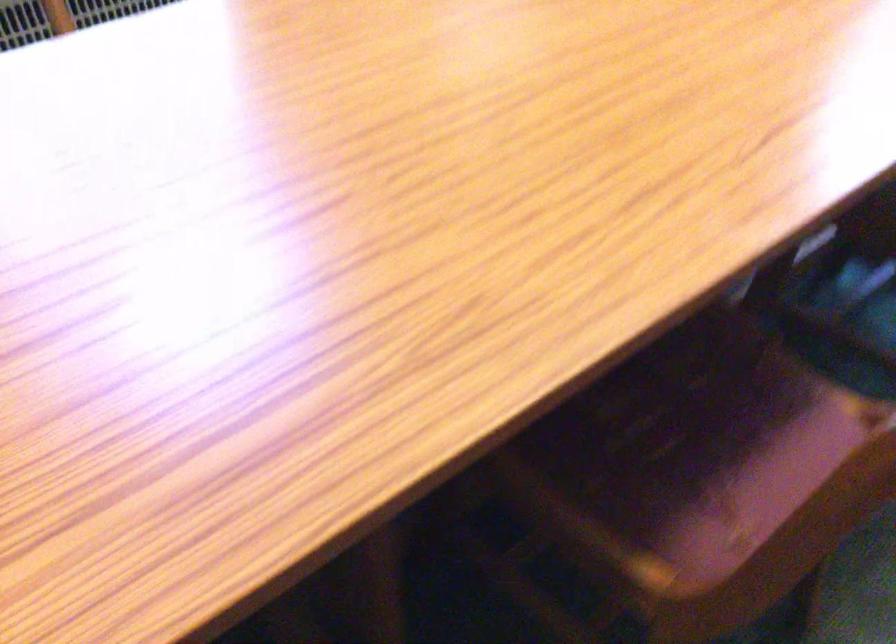
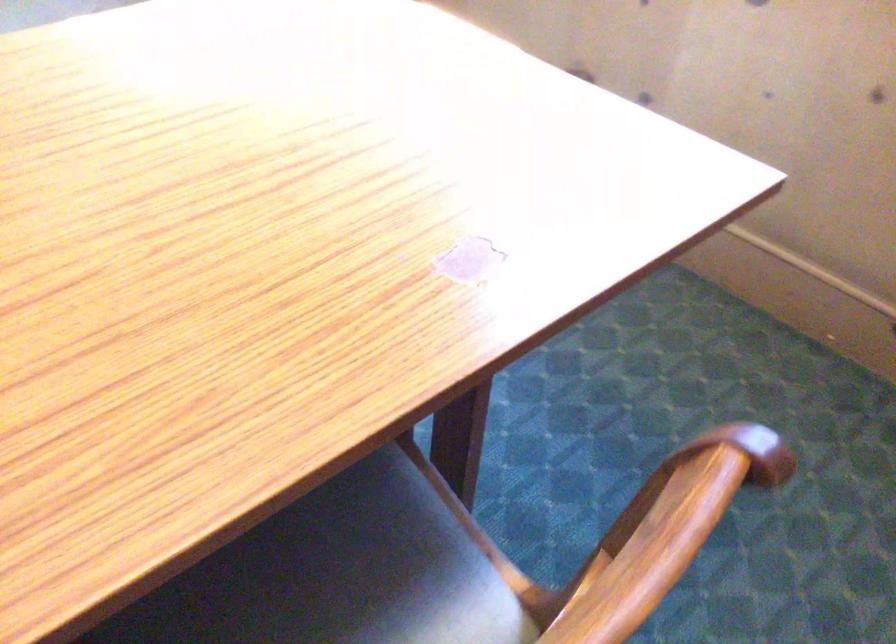
In a continuous first-person perspective shot, in which direction is the camera moving?

The movement direction of the cameraman is right, forward.